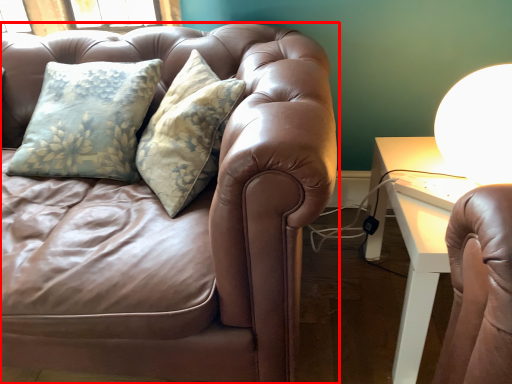
Question: From the image's perspective, where is studio couch (annotated by the red box) located relative to table lamp?

Choices:
 (A) above
 (B) below

Answer: (B)